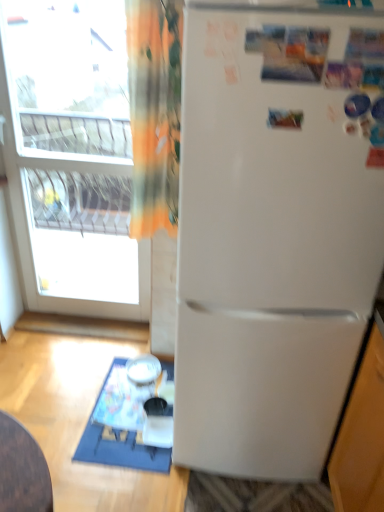
Identify the location of free region under transparent glass window at upper left (from a real-world perspective). (99, 320).